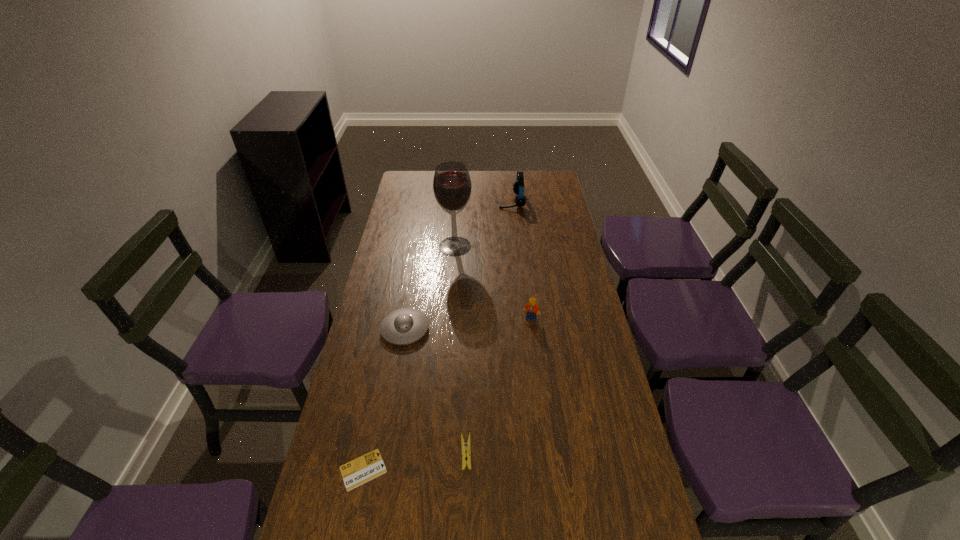
Where is `vacant space located with the microphone attached to the side of the fifth shortest object`? vacant space located with the microphone attached to the side of the fifth shortest object is located at coordinates (422, 201).

Where is `vacant space located with the microphone attached to the side of the fifth shortest object`? The image size is (960, 540). vacant space located with the microphone attached to the side of the fifth shortest object is located at coordinates (426, 201).

Find the location of a particular element. This screenshot has height=540, width=960. vacant space located 0.110m on the front-facing side of the Lego is located at coordinates tap(535, 347).

Find the location of a particular element. The image size is (960, 540). vacant space located on the back of the fourth tallest object is located at coordinates 410,300.

Locate an element on the screen. This screenshot has height=540, width=960. vacant space located 0.320m on the left of the fifth tallest object is located at coordinates (337, 452).

You are a GUI agent. You are given a task and a screenshot of the screen. Output one action in this format:
    pyautogui.click(x=<x>, y=<y>)
    Task: Click on the free location located on the right of the identity card
    
    Given the screenshot: What is the action you would take?
    pyautogui.click(x=415, y=470)

The width and height of the screenshot is (960, 540). Find the location of `object at the far edge`. object at the far edge is located at coordinates (518, 187).

Locate an element on the screen. The width and height of the screenshot is (960, 540). saucer located at the left edge is located at coordinates pos(404,326).

The height and width of the screenshot is (540, 960). Find the location of `identity card positioned at the left edge`. identity card positioned at the left edge is located at coordinates (369, 466).

In the image, there is a desktop. What are the coordinates of `free region at the left edge` in the screenshot? It's located at (406, 218).